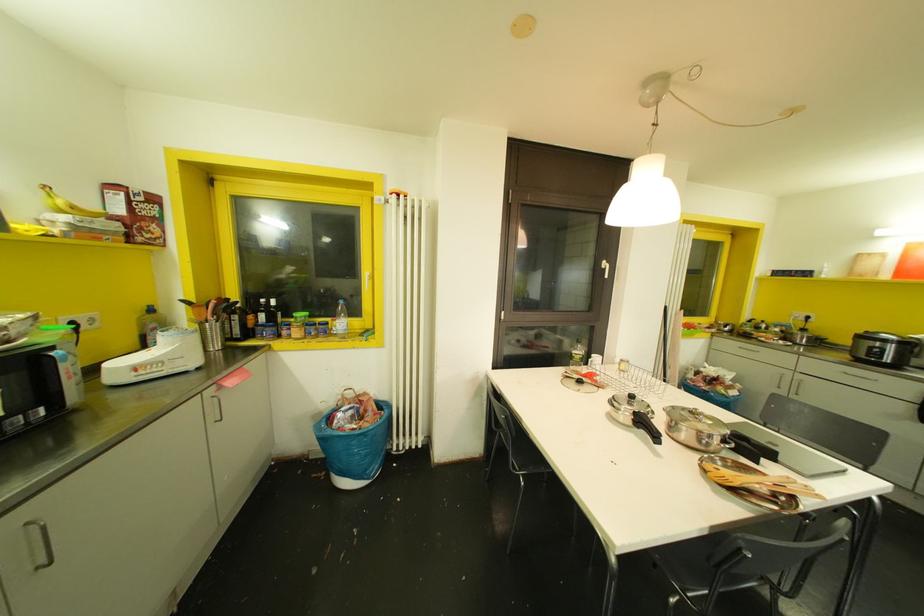
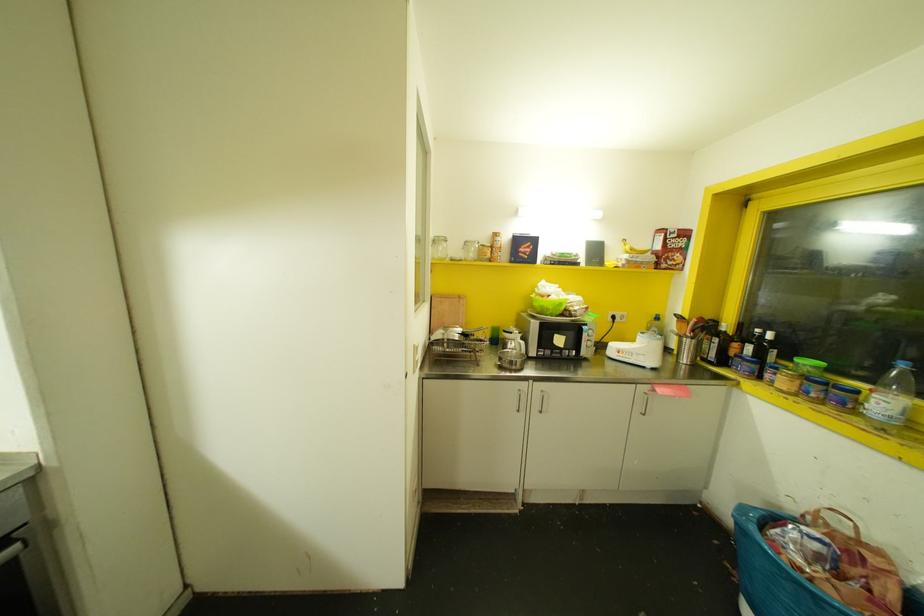
The point at (248,334) is marked in the first image. Where is the corresponding point in the second image?

(723, 361)